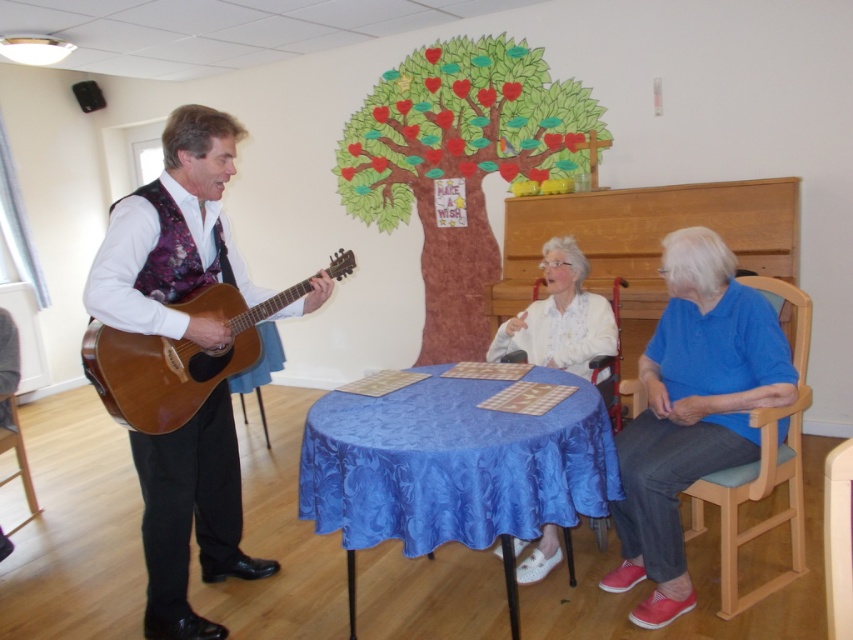
You are a stagehand setting up for a performance. You need to place a music stand between the wooden chair at right and the white satin blouse at center. Which object should the music stand be closer to, considering their heights?

The wooden chair at right is much taller than the white satin blouse at center, so the music stand should be placed closer to the wooden chair at right to ensure it is at an appropriate height for the performer.

You are attending a community event and want to sit down. There is a wooden chair at right and a white satin blouse at center. Which object is closer to the floor?

The wooden chair at right is located below the white satin blouse at center, so it is closer to the floor.

You are attending a community event and need to sit down. There are two wooden chairs available. The wooden chair at right and the wooden chair at lower center. Which chair is located to the right of the other?

The wooden chair at right is positioned on the right side of wooden chair at lower center.